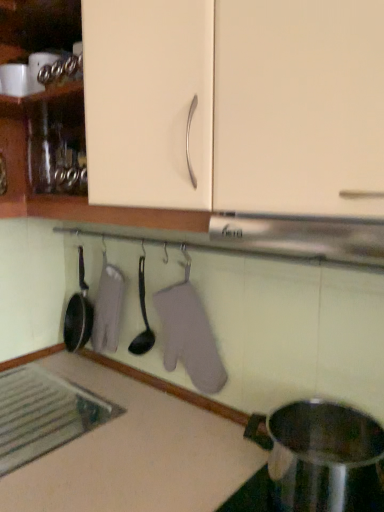
Question: Considering the relative positions of stainless steel pot at lower right and matte cream cabinet at upper center in the image provided, is stainless steel pot at lower right behind matte cream cabinet at upper center?

Choices:
 (A) no
 (B) yes

Answer: (B)

Question: Does stainless steel pot at lower right have a lesser height compared to matte cream cabinet at upper center?

Choices:
 (A) no
 (B) yes

Answer: (B)

Question: From the image's perspective, is stainless steel pot at lower right beneath matte cream cabinet at upper center?

Choices:
 (A) no
 (B) yes

Answer: (B)

Question: Is stainless steel pot at lower right oriented towards matte cream cabinet at upper center?

Choices:
 (A) yes
 (B) no

Answer: (B)

Question: Is stainless steel pot at lower right beside matte cream cabinet at upper center?

Choices:
 (A) no
 (B) yes

Answer: (A)

Question: From the image's perspective, is black plastic spoon at center positioned above or below stainless steel pot at lower right?

Choices:
 (A) below
 (B) above

Answer: (B)

Question: Relative to stainless steel pot at lower right, is black plastic spoon at center in front or behind?

Choices:
 (A) behind
 (B) front

Answer: (A)

Question: Considering the positions of point (150, 337) and point (370, 437), is point (150, 337) closer or farther from the camera than point (370, 437)?

Choices:
 (A) closer
 (B) farther

Answer: (B)

Question: Is black plastic spoon at center wider or thinner than stainless steel pot at lower right?

Choices:
 (A) thin
 (B) wide

Answer: (A)

Question: In terms of size, does stainless steel pot at lower right appear bigger or smaller than gray fabric oven mitt at center?

Choices:
 (A) big
 (B) small

Answer: (A)

Question: In terms of width, does stainless steel pot at lower right look wider or thinner when compared to gray fabric oven mitt at center?

Choices:
 (A) wide
 (B) thin

Answer: (A)

Question: From a real-world perspective, is stainless steel pot at lower right above or below gray fabric oven mitt at center?

Choices:
 (A) above
 (B) below

Answer: (B)

Question: Would you say stainless steel pot at lower right is to the left or to the right of gray fabric oven mitt at center in the picture?

Choices:
 (A) right
 (B) left

Answer: (A)

Question: Is point (213, 373) closer or farther from the camera than point (302, 156)?

Choices:
 (A) closer
 (B) farther

Answer: (B)

Question: Is gray fabric oven mitt at center wider or thinner than matte cream cabinet at upper center?

Choices:
 (A) thin
 (B) wide

Answer: (A)